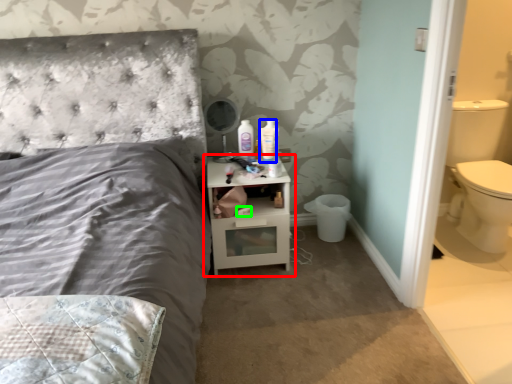
Question: Which object is positioned farthest from nightstand (highlighted by a red box)? Select from mouthwash (highlighted by a blue box) and toilet paper (highlighted by a green box).

Choices:
 (A) mouthwash
 (B) toilet paper

Answer: (A)